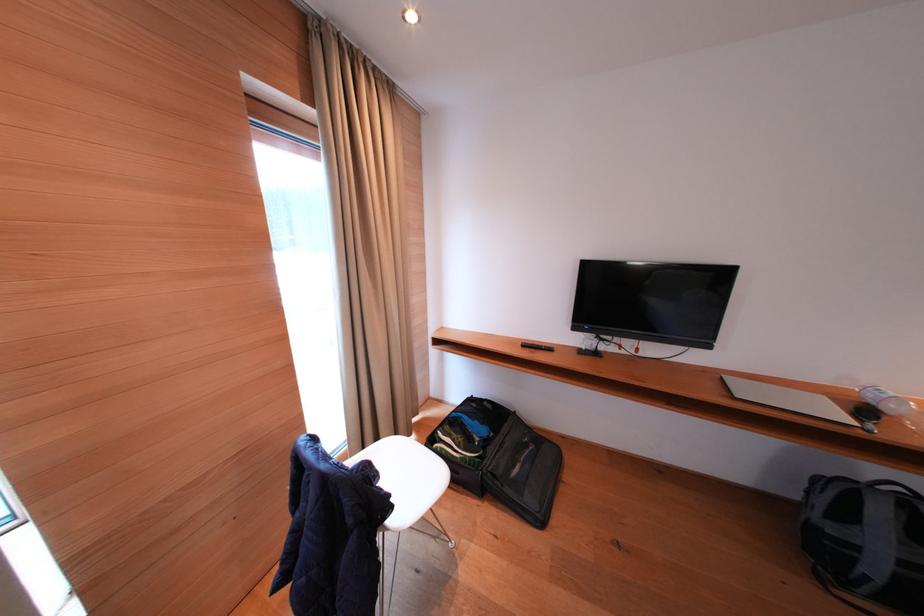
What do you see at coordinates (366, 236) in the screenshot?
I see `the beige curtain edge` at bounding box center [366, 236].